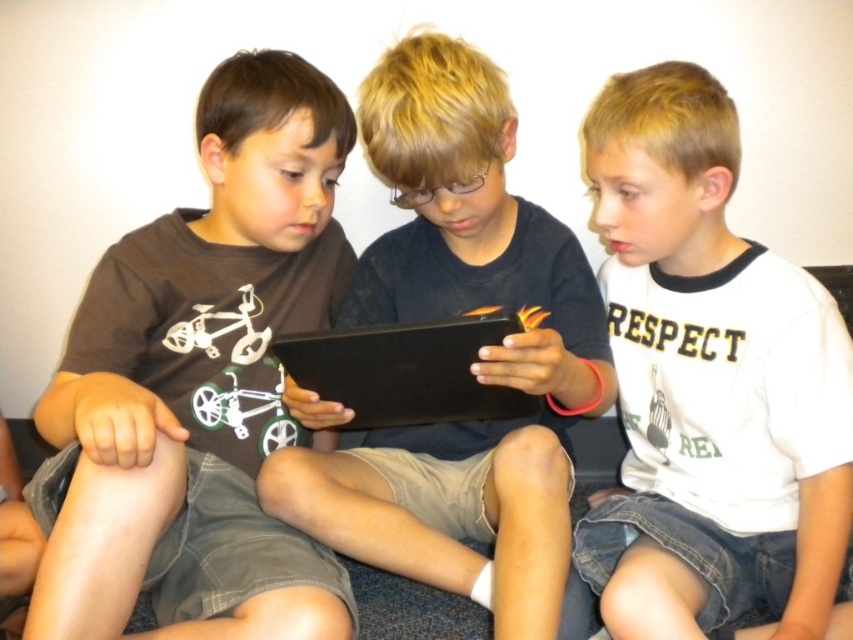
Which is in front, point (283, 253) or point (374, 362)?

Point (374, 362)

Measure the distance from matte black shirt at left to black matte laptop at center.

10.79 inches

Identify the location of matte black shirt at left. The width and height of the screenshot is (853, 640). (202, 380).

Measure the distance from black matte tablet at center to black matte laptop at center.

black matte tablet at center is 4.55 inches from black matte laptop at center.

Can you confirm if black matte tablet at center is positioned below black matte laptop at center?

Incorrect, black matte tablet at center is not positioned below black matte laptop at center.

Image resolution: width=853 pixels, height=640 pixels. I want to click on black matte tablet at center, so click(x=473, y=364).

I want to click on black matte tablet at center, so pyautogui.click(x=473, y=364).

Is white cotton shirt at center above black matte tablet at center?

No, white cotton shirt at center is not above black matte tablet at center.

Between point (659, 476) and point (413, 481), which one is positioned behind?

The point (659, 476) is behind.

This screenshot has height=640, width=853. I want to click on white cotton shirt at center, so click(x=711, y=387).